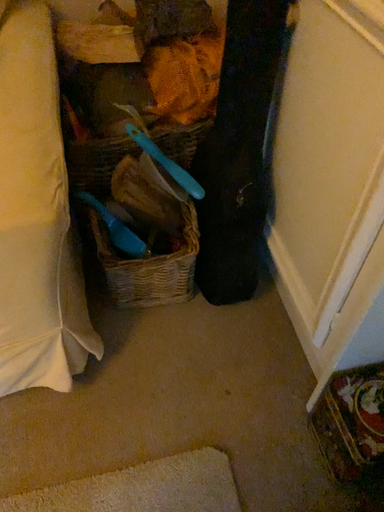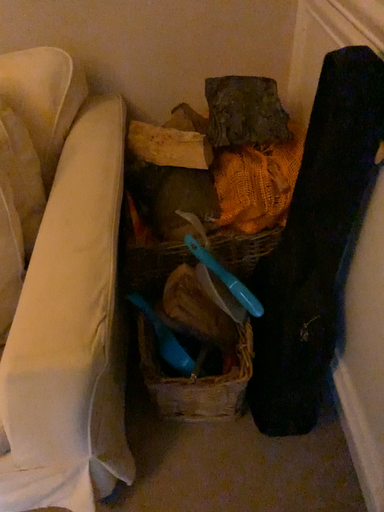
Question: Which way did the camera rotate in the video?

Choices:
 (A) rotated upward
 (B) rotated downward

Answer: (A)